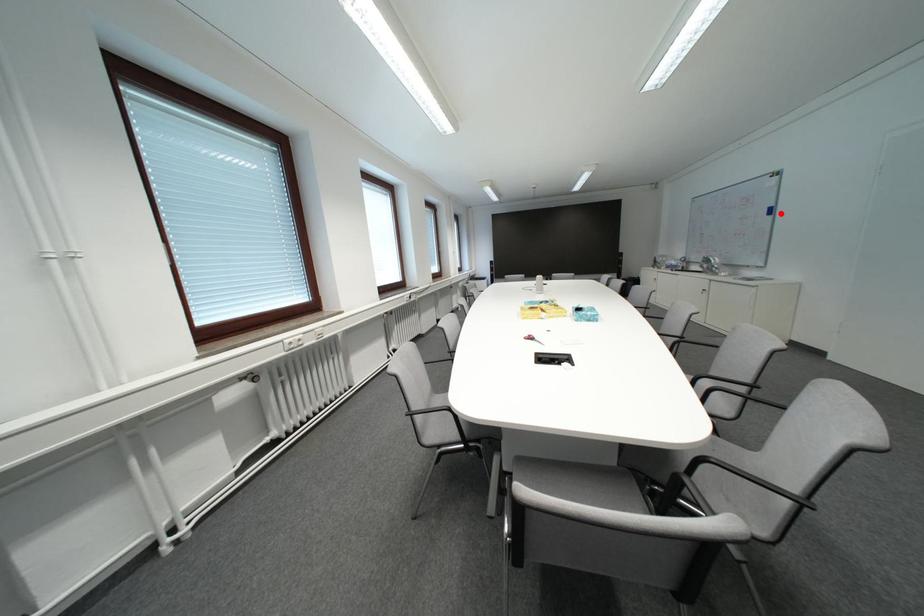
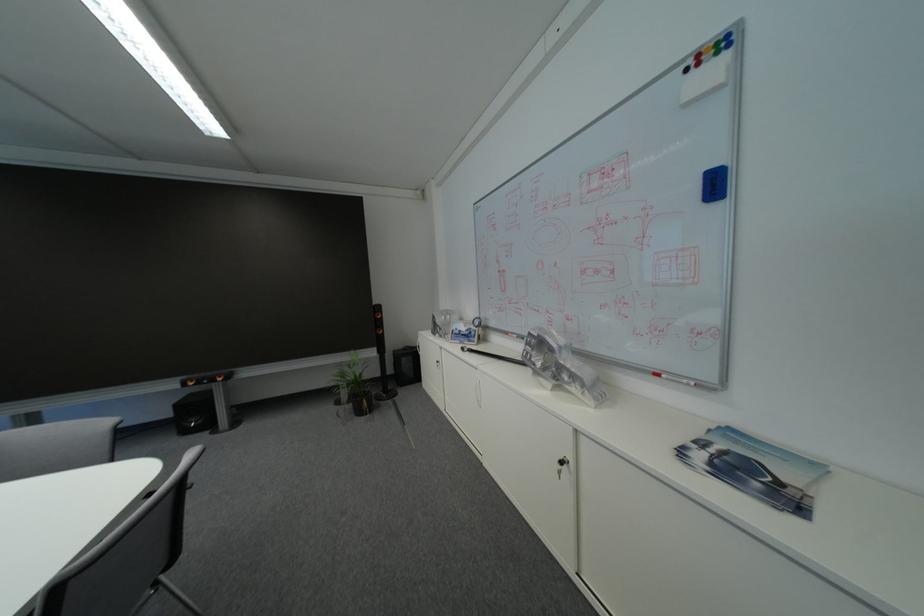
Find the pixel in the second image that matches the highlighted location in the first image.

(726, 188)